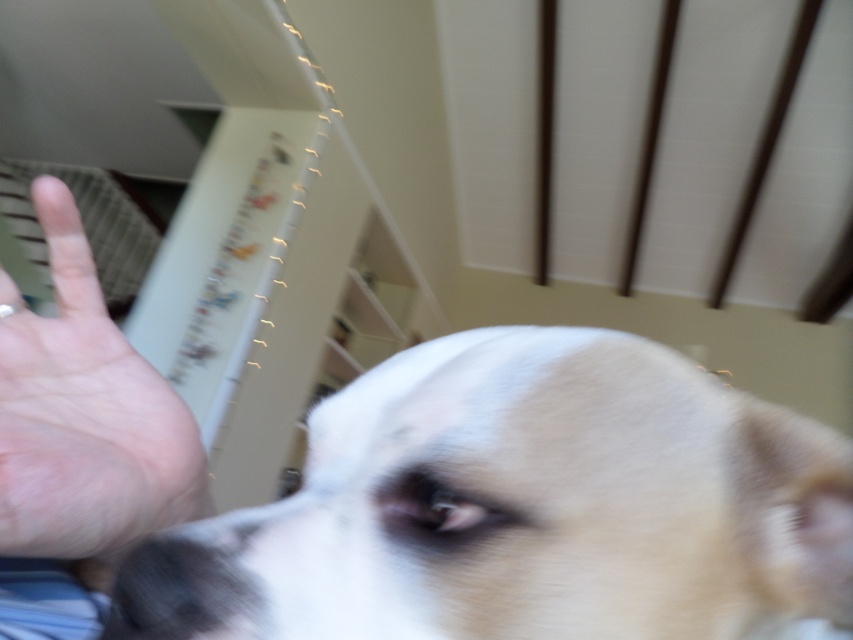
Based on the photo, you are a photographer trying to capture a close shot of the white fur dog at center. The pale skin palm at upper left is blocking part of the dog. Can you move the palm down to get a better view of the dog?

The white fur dog at center is shorter than the pale skin palm at upper left. Moving the palm down would allow the photographer to see more of the dog since the palm is taller than the dog.

You are a photographer trying to capture a closeup of the white fur dog at center. If your camera requires the subject to be at least 10 inches away to focus properly, will you need to adjust your position?

The white fur dog at center is only 8.82 inches away from the camera, which is less than the required 10 inches for proper focus. You should move further away or adjust your camera settings to ensure the subject is in focus.